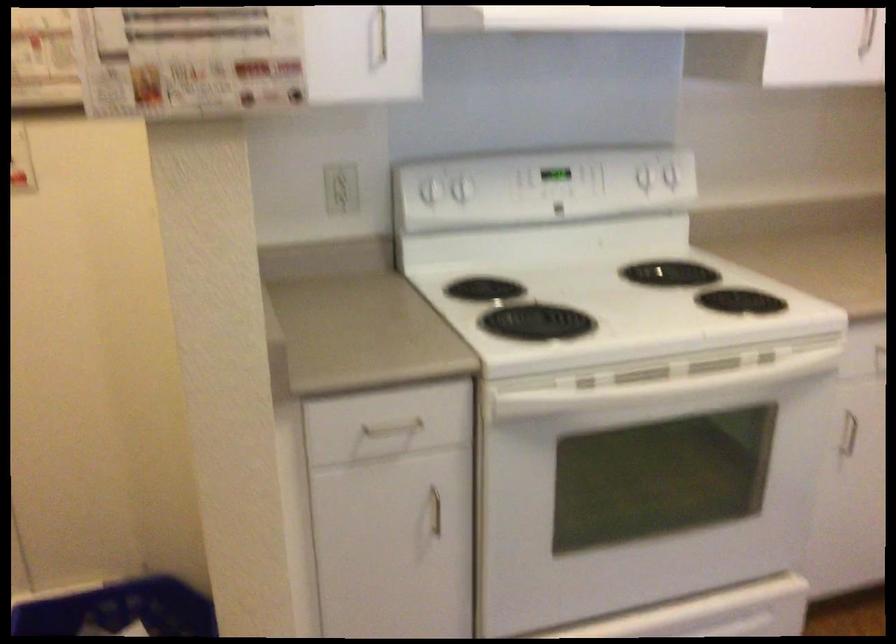
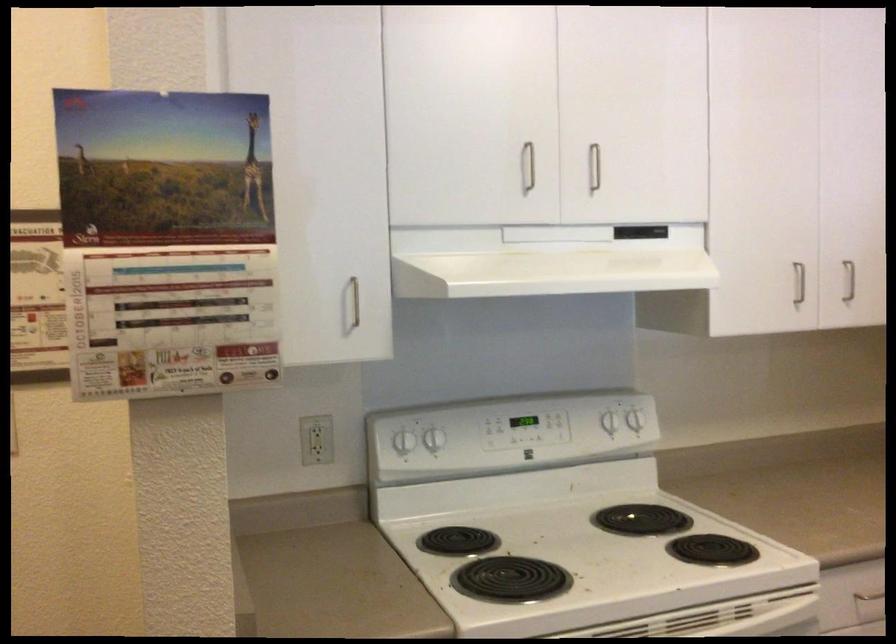
In the second image, find the point that corresponds to (670,173) in the first image.

(634, 420)